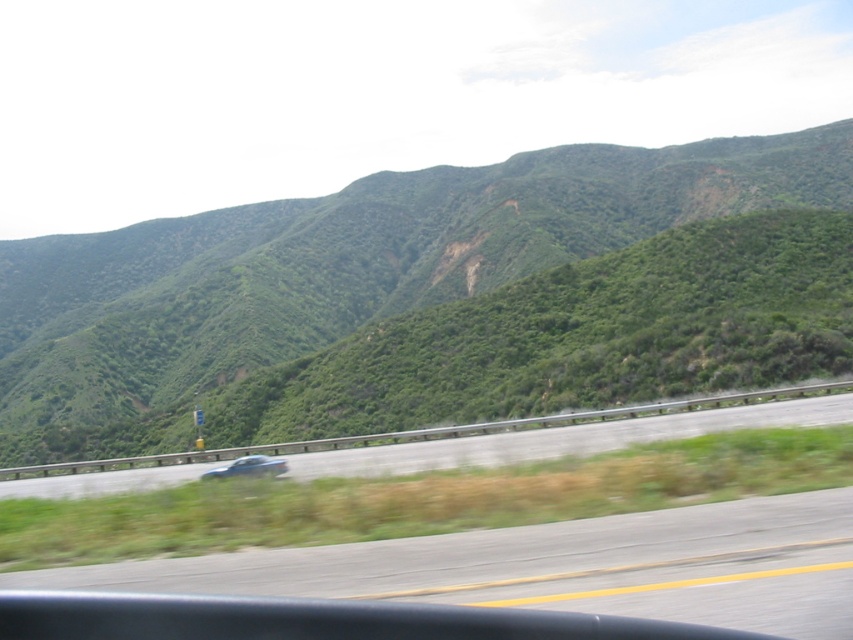
Does green leafy hillside at center appear on the left side of metallic blue sedan at center?

Correct, you'll find green leafy hillside at center to the left of metallic blue sedan at center.

Is point (53, 426) positioned behind point (282, 465)?

Yes, it is.

Image resolution: width=853 pixels, height=640 pixels. I want to click on green leafy hillside at center, so click(410, 285).

Who is more forward, (x=776, y=424) or (x=222, y=470)?

Point (x=222, y=470) is in front.

Is gray asphalt highway at center wider than metallic blue sedan at center?

Yes, gray asphalt highway at center is wider than metallic blue sedan at center.

Is point (527, 432) positioned behind point (247, 467)?

That is True.

Locate an element on the screen. The height and width of the screenshot is (640, 853). gray asphalt highway at center is located at coordinates (561, 433).

Is point (335, 211) farther from camera compared to point (804, 394)?

Yes.

How far apart are green leafy hillside at center and gray asphalt highway at center?

97.03 meters

What are the coordinates of `green leafy hillside at center` in the screenshot? It's located at tap(410, 285).